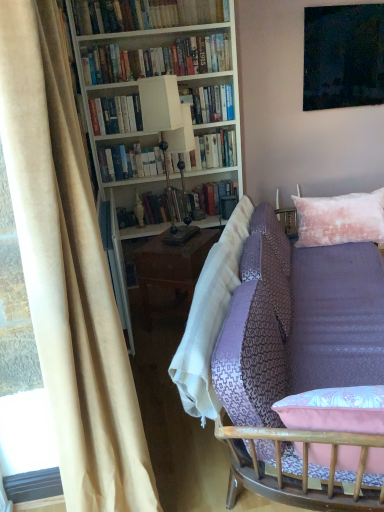
Where is `blank space situated above hardcover books at upper center, arranged as the third book when ordered from the bottom (from a real-world perspective)`? blank space situated above hardcover books at upper center, arranged as the third book when ordered from the bottom (from a real-world perspective) is located at coordinates (152, 40).